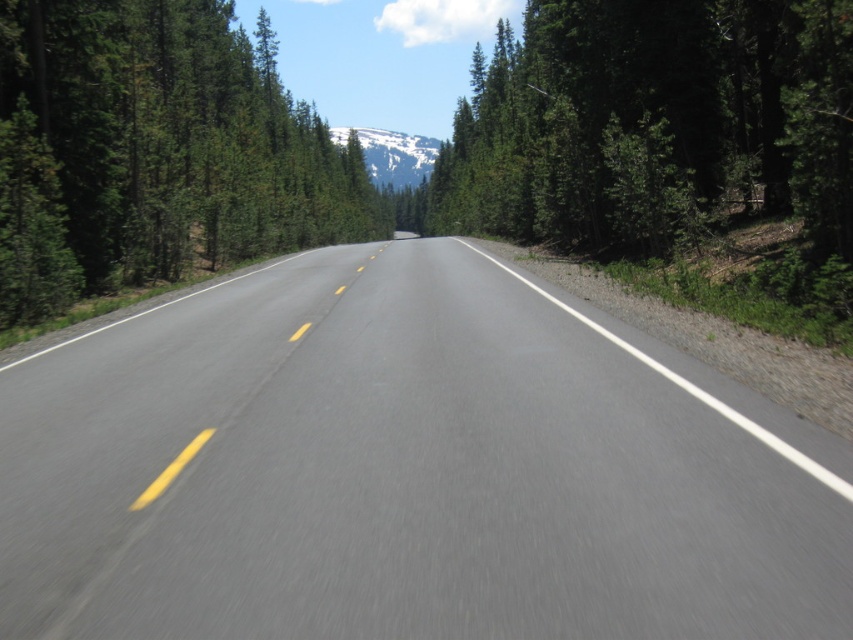
Does green matte tree at left have a greater height compared to snowy white mountain at center?

Correct, green matte tree at left is much taller as snowy white mountain at center.

This screenshot has width=853, height=640. In order to click on green matte tree at left in this screenshot , I will do `click(155, 150)`.

I want to click on green matte tree at left, so click(155, 150).

Does smooth asphalt road at center have a greater height compared to green matte tree at left?

In fact, smooth asphalt road at center may be shorter than green matte tree at left.

Can you confirm if smooth asphalt road at center is thinner than green matte tree at left?

Correct, smooth asphalt road at center's width is less than green matte tree at left's.

Measure the distance between smooth asphalt road at center and camera.

3.52 meters

Find the location of a particular element. Image resolution: width=853 pixels, height=640 pixels. smooth asphalt road at center is located at coordinates (405, 470).

How far apart are smooth asphalt road at center and snowy white mountain at center?

A distance of 216.72 meters exists between smooth asphalt road at center and snowy white mountain at center.

From the picture: Between smooth asphalt road at center and snowy white mountain at center, which one appears on the left side from the viewer's perspective?

Positioned to the left is snowy white mountain at center.

Is point (225, 422) closer to viewer compared to point (392, 163)?

Yes, it is.

Identify the location of smooth asphalt road at center. (405, 470).